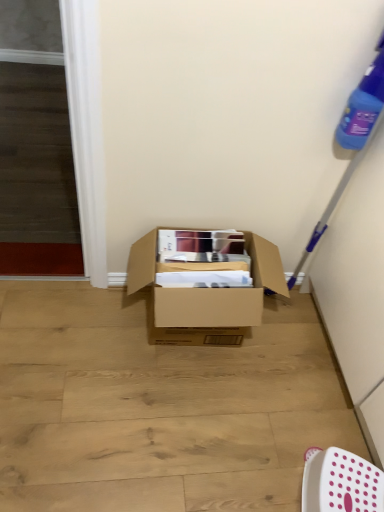
At what (x,y) coordinates should I click in order to perform the action: click on free space to the left of brown cardboard box at center. Please return your answer as a coordinate pair (x, y). This screenshot has height=512, width=384. Looking at the image, I should click on (82, 338).